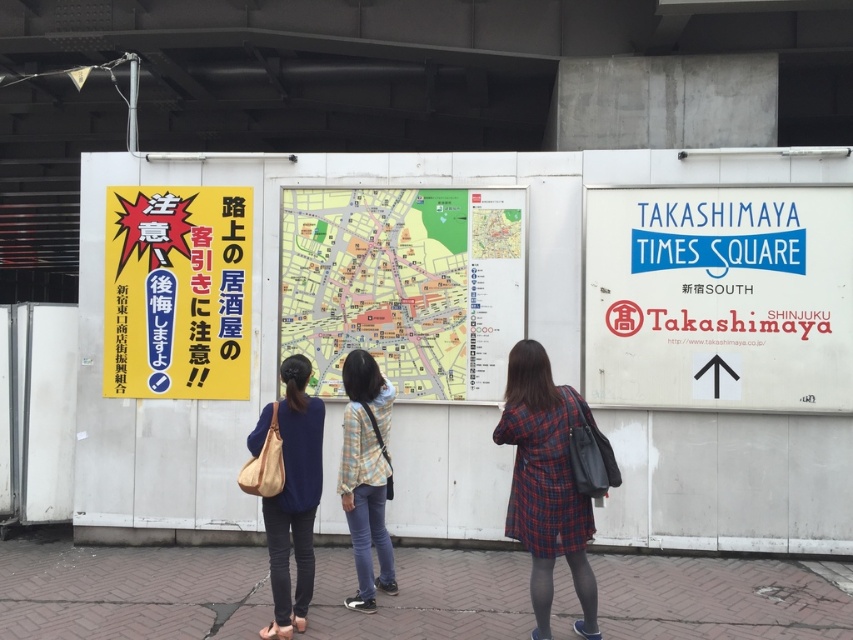
From the picture: Between plaid fabric dress at lower right and light blue denim jeans at center, which one appears on the left side from the viewer's perspective?

light blue denim jeans at center

Does plaid fabric dress at lower right have a greater width compared to light blue denim jeans at center?

Indeed, plaid fabric dress at lower right has a greater width compared to light blue denim jeans at center.

What are the coordinates of `plaid fabric dress at lower right` in the screenshot? It's located at (546, 483).

Between brick pavement at lower center and blue fabric bag at center, which one appears on the right side from the viewer's perspective?

brick pavement at lower center

Can you confirm if brick pavement at lower center is smaller than blue fabric bag at center?

Actually, brick pavement at lower center might be larger than blue fabric bag at center.

Between point (341, 563) and point (293, 608), which one is positioned behind?

Point (341, 563)

Image resolution: width=853 pixels, height=640 pixels. I want to click on brick pavement at lower center, so click(131, 592).

How distant is brick pavement at lower center from yellow paper map at center?

brick pavement at lower center and yellow paper map at center are 5.46 feet apart.

Looking at this image, is brick pavement at lower center shorter than yellow paper map at center?

Indeed, brick pavement at lower center has a lesser height compared to yellow paper map at center.

This screenshot has width=853, height=640. What do you see at coordinates (131, 592) in the screenshot?
I see `brick pavement at lower center` at bounding box center [131, 592].

The height and width of the screenshot is (640, 853). Identify the location of brick pavement at lower center. (131, 592).